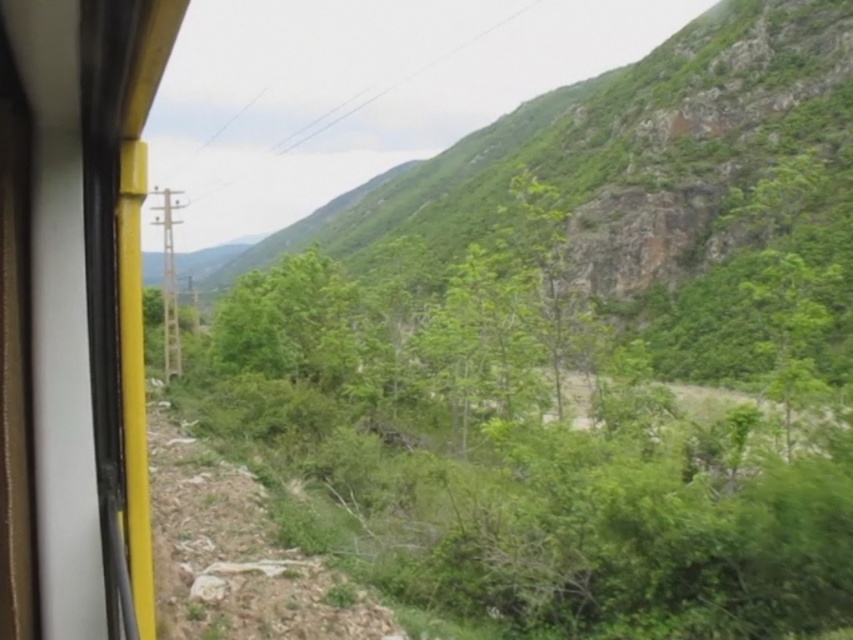
Can you confirm if green leafy shrubs at center is wider than matte yellow train window at left?

Yes, green leafy shrubs at center is wider than matte yellow train window at left.

Is point (848, 234) farther from viewer compared to point (123, 275)?

Yes, point (848, 234) is behind point (123, 275).

In order to click on green leafy shrubs at center in this screenshot , I will do `click(538, 442)`.

Is point (212, 342) positioned in front of point (656, 346)?

Yes, it is in front of point (656, 346).

Where is `green leafy shrubs at center`? The width and height of the screenshot is (853, 640). green leafy shrubs at center is located at coordinates (538, 442).

Who is lower down, green leafy hillside at center or matte yellow train window at left?

matte yellow train window at left

Which is above, green leafy hillside at center or matte yellow train window at left?

Positioned higher is green leafy hillside at center.

Is point (648, 77) farther from camera compared to point (30, 484)?

Yes, it is.

You are a GUI agent. You are given a task and a screenshot of the screen. Output one action in this format:
    pyautogui.click(x=<x>, y=<y>)
    Task: Click on the green leafy hillside at center
    
    Given the screenshot: What is the action you would take?
    637,173